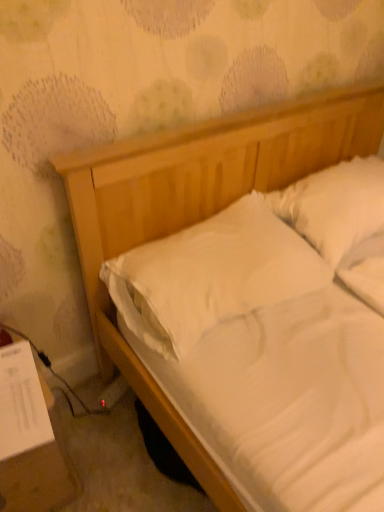
I want to click on white soft pillow at center, which appears as the first pillow when viewed from the left, so click(211, 275).

What do you see at coordinates (211, 275) in the screenshot? I see `white soft pillow at center, which appears as the first pillow when viewed from the left` at bounding box center [211, 275].

The image size is (384, 512). In order to click on white soft pillow at upper right, which is counted as the first pillow, starting from the right in this screenshot , I will do `click(335, 206)`.

Can you confirm if white soft pillow at center, which ranks as the 2th pillow in right-to-left order, is shorter than white soft pillow at upper right, the 2th pillow in the left-to-right sequence?

Correct, white soft pillow at center, which ranks as the 2th pillow in right-to-left order, is not as tall as white soft pillow at upper right, the 2th pillow in the left-to-right sequence.

Could you tell me if white soft pillow at center, which appears as the first pillow when viewed from the left, is facing white soft pillow at upper right, which is counted as the first pillow, starting from the right?

No, white soft pillow at center, which appears as the first pillow when viewed from the left, is not facing towards white soft pillow at upper right, which is counted as the first pillow, starting from the right.

From a real-world perspective, between white soft pillow at center, which ranks as the 2th pillow in right-to-left order, and white soft pillow at upper right, the 2th pillow in the left-to-right sequence, who is vertically lower?

From a 3D spatial view, white soft pillow at center, which ranks as the 2th pillow in right-to-left order, is below.

Can you confirm if white soft pillow at center, which appears as the first pillow when viewed from the left, is wider than white soft pillow at upper right, the 2th pillow in the left-to-right sequence?

Indeed, white soft pillow at center, which appears as the first pillow when viewed from the left, has a greater width compared to white soft pillow at upper right, the 2th pillow in the left-to-right sequence.

From a real-world perspective, between white paper at lower left and white soft pillow at upper right, which is counted as the first pillow, starting from the right, who is vertically higher?

From a 3D spatial view, white soft pillow at upper right, which is counted as the first pillow, starting from the right, is above.

Which object is positioned more to the left, white paper at lower left or white soft pillow at upper right, the 2th pillow in the left-to-right sequence?

From the viewer's perspective, white paper at lower left appears more on the left side.

Between point (53, 442) and point (308, 196), which one is positioned behind?

Positioned behind is point (308, 196).

The width and height of the screenshot is (384, 512). There is a white paper at lower left. In order to click on the 2nd pillow above it (from a real-world perspective) in this screenshot , I will do `click(335, 206)`.

From the image's perspective, relative to white paper at lower left, is white soft pillow at upper right, the 2th pillow in the left-to-right sequence, above or below?

white soft pillow at upper right, the 2th pillow in the left-to-right sequence, is situated higher than white paper at lower left in the image.

Is white soft pillow at upper right, which is counted as the first pillow, starting from the right, in front of or behind white paper at lower left in the image?

white soft pillow at upper right, which is counted as the first pillow, starting from the right, is behind white paper at lower left.

From a real-world perspective, which is physically above, white soft pillow at upper right, the 2th pillow in the left-to-right sequence, or white paper at lower left?

white soft pillow at upper right, the 2th pillow in the left-to-right sequence, is physically above.

Is white soft pillow at center, which ranks as the 2th pillow in right-to-left order, in front of or behind white paper at lower left in the image?

Clearly, white soft pillow at center, which ranks as the 2th pillow in right-to-left order, is behind white paper at lower left.

Which object is wider, white soft pillow at center, which ranks as the 2th pillow in right-to-left order, or white paper at lower left?

With larger width is white soft pillow at center, which ranks as the 2th pillow in right-to-left order.

Who is bigger, white soft pillow at center, which ranks as the 2th pillow in right-to-left order, or white paper at lower left?

white soft pillow at center, which ranks as the 2th pillow in right-to-left order.

Looking at this image, how far apart are white paper at lower left and white soft pillow at center, which appears as the first pillow when viewed from the left?

white paper at lower left is 64.11 centimeters from white soft pillow at center, which appears as the first pillow when viewed from the left.

Which object is thinner, white paper at lower left or white soft pillow at center, which ranks as the 2th pillow in right-to-left order?

white paper at lower left is thinner.

From the image's perspective, is white paper at lower left on top of white soft pillow at center, which ranks as the 2th pillow in right-to-left order?

Actually, white paper at lower left appears below white soft pillow at center, which ranks as the 2th pillow in right-to-left order, in the image.

Consider the image. Can you tell me how much white paper at lower left and white soft pillow at center, which ranks as the 2th pillow in right-to-left order, differ in facing direction?

0.0236 degrees separate the facing orientations of white paper at lower left and white soft pillow at center, which ranks as the 2th pillow in right-to-left order.

Does white soft pillow at upper right, which is counted as the first pillow, starting from the right, have a greater width compared to white soft pillow at center, which appears as the first pillow when viewed from the left?

No, white soft pillow at upper right, which is counted as the first pillow, starting from the right, is not wider than white soft pillow at center, which appears as the first pillow when viewed from the left.

From the image's perspective, which one is positioned lower, white soft pillow at upper right, which is counted as the first pillow, starting from the right, or white soft pillow at center, which ranks as the 2th pillow in right-to-left order?

white soft pillow at center, which ranks as the 2th pillow in right-to-left order, appears lower in the image.

From a real-world perspective, between white soft pillow at upper right, the 2th pillow in the left-to-right sequence, and white soft pillow at center, which ranks as the 2th pillow in right-to-left order, who is vertically higher?

white soft pillow at upper right, the 2th pillow in the left-to-right sequence.

Where is `pillow in front of the white soft pillow at upper right, the 2th pillow in the left-to-right sequence`? This screenshot has width=384, height=512. pillow in front of the white soft pillow at upper right, the 2th pillow in the left-to-right sequence is located at coordinates (211, 275).

The width and height of the screenshot is (384, 512). In order to click on pillow that appears on the left of white soft pillow at upper right, the 2th pillow in the left-to-right sequence in this screenshot , I will do `click(211, 275)`.

From the image's perspective, count 2nd pillows upward from the white paper at lower left and point to it. Please provide its 2D coordinates.

[(335, 206)]

Based on their spatial positions, is white soft pillow at center, which appears as the first pillow when viewed from the left, or white soft pillow at upper right, which is counted as the first pillow, starting from the right, further from white paper at lower left?

white soft pillow at upper right, which is counted as the first pillow, starting from the right, lies further to white paper at lower left than the other object.

Based on their spatial positions, is white paper at lower left or white soft pillow at center, which appears as the first pillow when viewed from the left, further from white soft pillow at upper right, the 2th pillow in the left-to-right sequence?

The object further to white soft pillow at upper right, the 2th pillow in the left-to-right sequence, is white paper at lower left.

Based on the photo, estimate the real-world distances between objects in this image. Which object is closer to white paper at lower left, white soft pillow at upper right, which is counted as the first pillow, starting from the right, or white soft pillow at center, which ranks as the 2th pillow in right-to-left order?

Based on the image, white soft pillow at center, which ranks as the 2th pillow in right-to-left order, appears to be nearer to white paper at lower left.

From the image, which object appears to be nearer to white soft pillow at center, which ranks as the 2th pillow in right-to-left order, white paper at lower left or white soft pillow at upper right, which is counted as the first pillow, starting from the right?

white soft pillow at upper right, which is counted as the first pillow, starting from the right.

From the image, which object appears to be farther from white soft pillow at upper right, the 2th pillow in the left-to-right sequence, white soft pillow at center, which ranks as the 2th pillow in right-to-left order, or white paper at lower left?

white paper at lower left.

Looking at the image, which one is located closer to white soft pillow at center, which appears as the first pillow when viewed from the left, white soft pillow at upper right, which is counted as the first pillow, starting from the right, or white paper at lower left?

Among the two, white soft pillow at upper right, which is counted as the first pillow, starting from the right, is located nearer to white soft pillow at center, which appears as the first pillow when viewed from the left.

The height and width of the screenshot is (512, 384). Identify the location of pillow situated between white paper at lower left and white soft pillow at upper right, the 2th pillow in the left-to-right sequence, from left to right. click(211, 275).